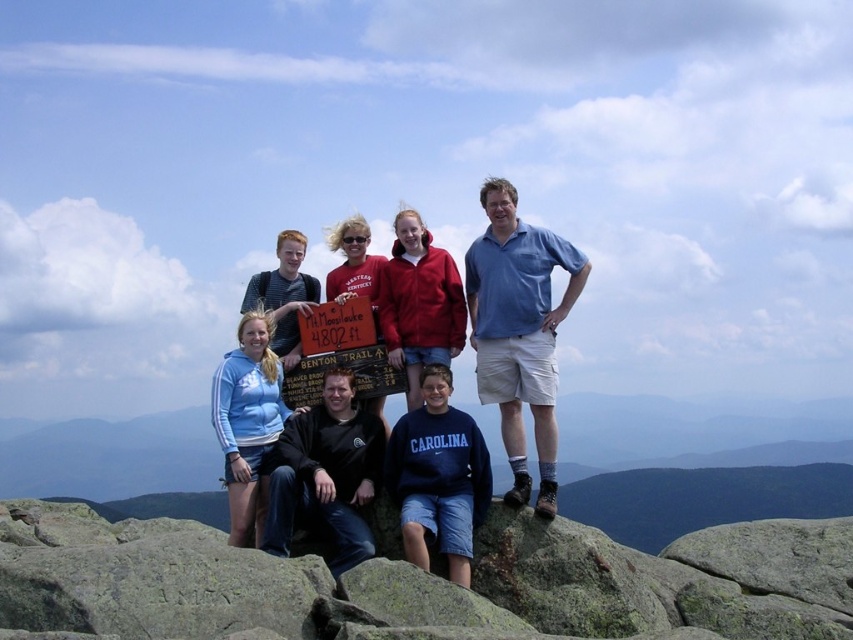
You are a photographer standing at the base of the mountain. You want to take a photo of the blue cotton shirt at center and the light blue fleece at center so that both are clearly visible. Given that your camera has a maximum focus range of 20 meters, can you capture both subjects in focus at the same time?

The blue cotton shirt at center and light blue fleece at center are 18.03 meters apart from each other. Since the distance between them is within the camera maximum focus range of 20 meters, you can capture both subjects in focus at the same time.

Looking at this image, you are a photographer trying to capture a clear shot of both the blue cotton shirt at center and the light blue fleece at center. Since the camera can only focus on one subject at a time, which clothing item should you choose to ensure the other remains recognizable in the background?

The blue cotton shirt at center is larger than the light blue fleece at center. Therefore, focusing on the blue cotton shirt at center will allow the smaller light blue fleece at center to still be recognizable in the background.

You are a photographer taking a group photo of the hikers on the rocky outcrop. You want to ensure both the blue cotton shirt at center and the red fleece jacket at center are visible in the frame. Based on their positions, which clothing item will appear lower in the photo?

The blue cotton shirt at center is below the red fleece jacket at center, so the blue cotton shirt at center will appear lower in the photo.